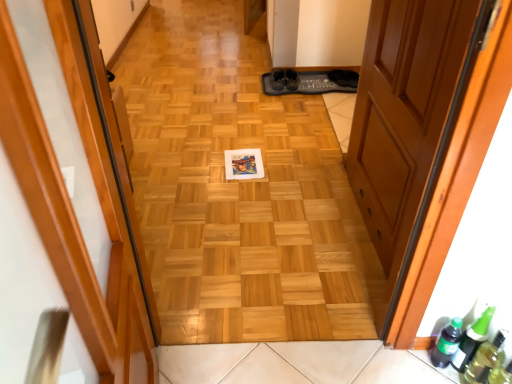
Question: Looking at their shapes, would you say green matte bottle at lower right, which appears as the second beer bottle when viewed from the right, is wider or thinner than wooden door at center, the second door from the left?

Choices:
 (A) thin
 (B) wide

Answer: (B)

Question: Based on their positions, is green matte bottle at lower right, which is counted as the 1th beer bottle, starting from the left, located to the left or right of wooden door at center, which ranks as the first door in right-to-left order?

Choices:
 (A) left
 (B) right

Answer: (B)

Question: Which is nearer to the wooden door at center, which appears as the second door when viewed from the right?

Choices:
 (A) transparent plastic bottle at lower right
 (B) wooden floor at center
 (C) green matte bottle at lower right, which appears as the second beer bottle when viewed from the right
 (D) green glass beer bottle at lower right, positioned as the first beer bottle in right-to-left order
 (E) wooden door at center, the second door from the left

Answer: (E)

Question: Estimate the real-world distances between objects in this image. Which object is farther from the wooden door at center, which ranks as the first door in right-to-left order?

Choices:
 (A) green matte bottle at lower right, which appears as the second beer bottle when viewed from the right
 (B) green glass beer bottle at lower right, acting as the second beer bottle starting from the left
 (C) wooden door at center, which appears as the second door when viewed from the right
 (D) transparent plastic bottle at lower right
 (E) wooden floor at center

Answer: (C)